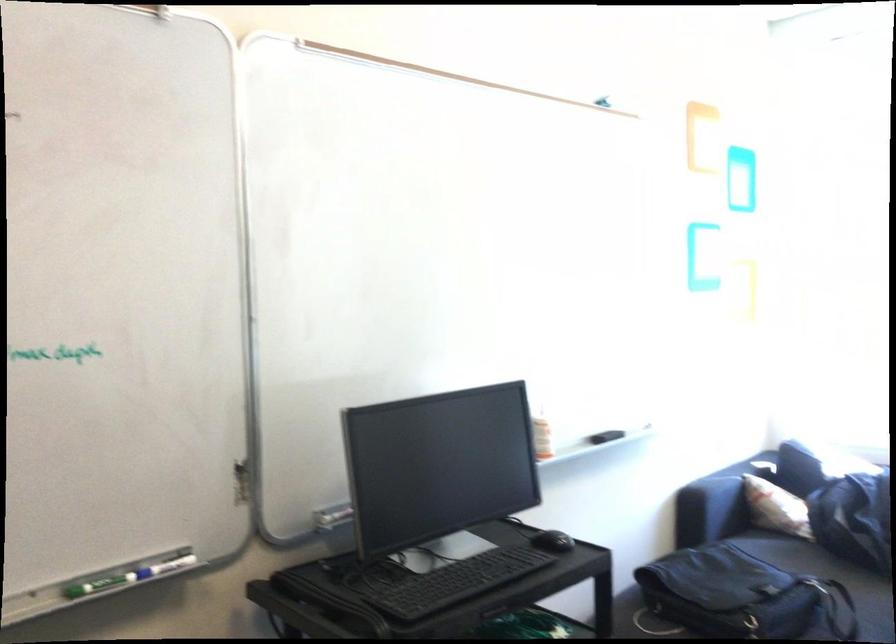
Find the location of a particular element. sofa sitting surface is located at coordinates (828, 576).